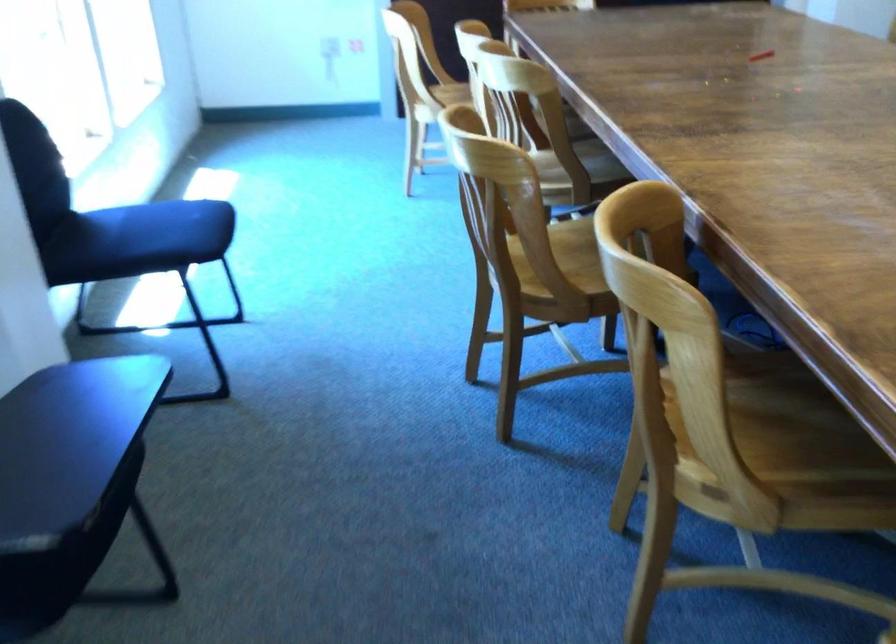
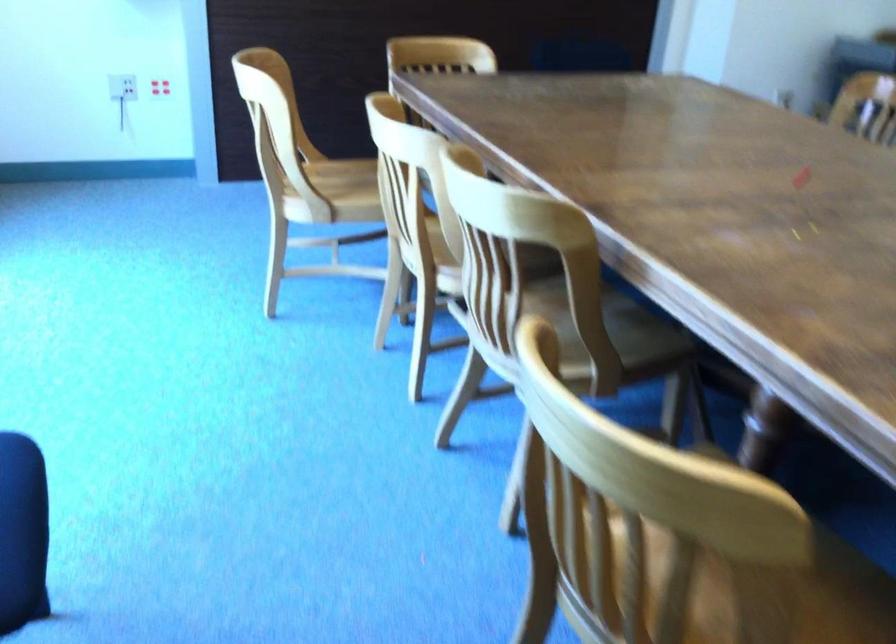
Find the pixel in the second image that matches (453,91) in the first image.

(347, 180)